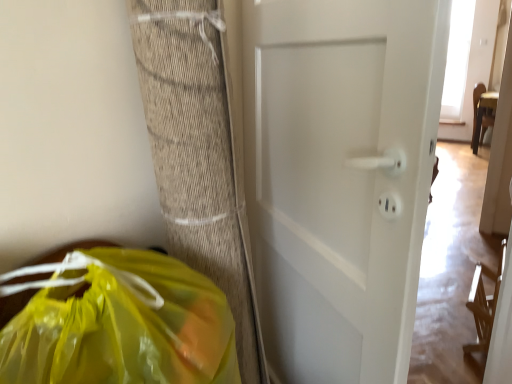
Question: Does point (393, 221) appear closer or farther from the camera than point (219, 309)?

Choices:
 (A) farther
 (B) closer

Answer: (B)

Question: Which is correct: white matte door at center is inside translucent yellow plastic bag at lower left, or outside of it?

Choices:
 (A) inside
 (B) outside

Answer: (B)

Question: In terms of size, does white matte door at center appear bigger or smaller than translucent yellow plastic bag at lower left?

Choices:
 (A) small
 (B) big

Answer: (B)

Question: In terms of height, does translucent yellow plastic bag at lower left look taller or shorter compared to white matte door at center?

Choices:
 (A) short
 (B) tall

Answer: (A)

Question: Considering the positions of translucent yellow plastic bag at lower left and white matte door at center in the image, is translucent yellow plastic bag at lower left wider or thinner than white matte door at center?

Choices:
 (A) wide
 (B) thin

Answer: (A)

Question: Would you say translucent yellow plastic bag at lower left is inside or outside white matte door at center?

Choices:
 (A) outside
 (B) inside

Answer: (A)

Question: Looking at the image, does translucent yellow plastic bag at lower left seem bigger or smaller compared to white matte door at center?

Choices:
 (A) big
 (B) small

Answer: (B)